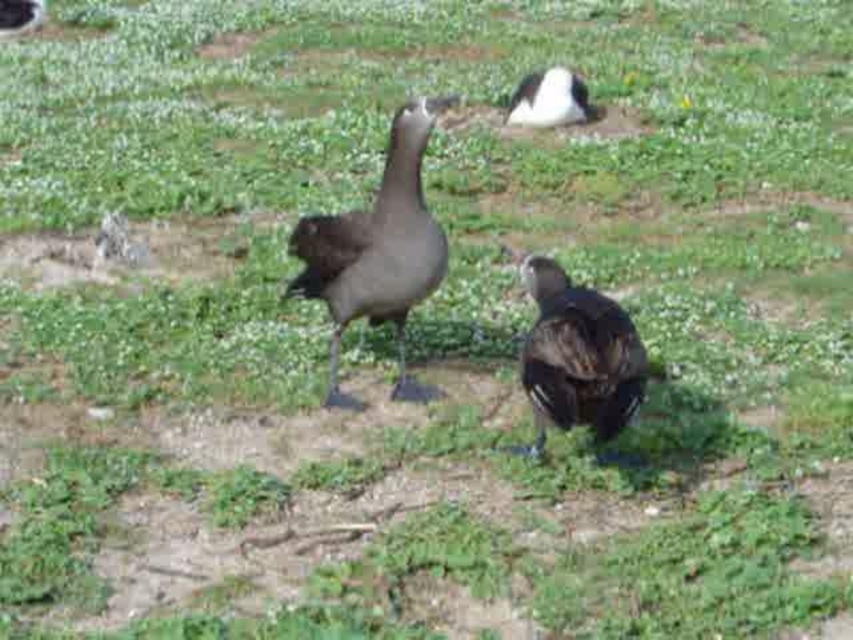
Does dark gray matte duck at center have a smaller size compared to white fluffy duck at upper center?

No.

Which is more to the left, dark gray matte duck at center or white fluffy duck at upper center?

Positioned to the left is dark gray matte duck at center.

I want to click on dark gray matte duck at center, so click(376, 252).

Is point (410, 179) less distant than point (538, 355)?

That is False.

Does dark gray matte duck at center appear on the right side of dark brown feathers at center?

In fact, dark gray matte duck at center is to the left of dark brown feathers at center.

Which is in front, point (310, 291) or point (567, 392)?

Positioned in front is point (567, 392).

Locate an element on the screen. dark gray matte duck at center is located at coordinates (376, 252).

Consider the image. Who is more distant from viewer, [576,396] or [554,84]?

Point [554,84]

Where is `dark brown feathers at center`? dark brown feathers at center is located at coordinates (578, 356).